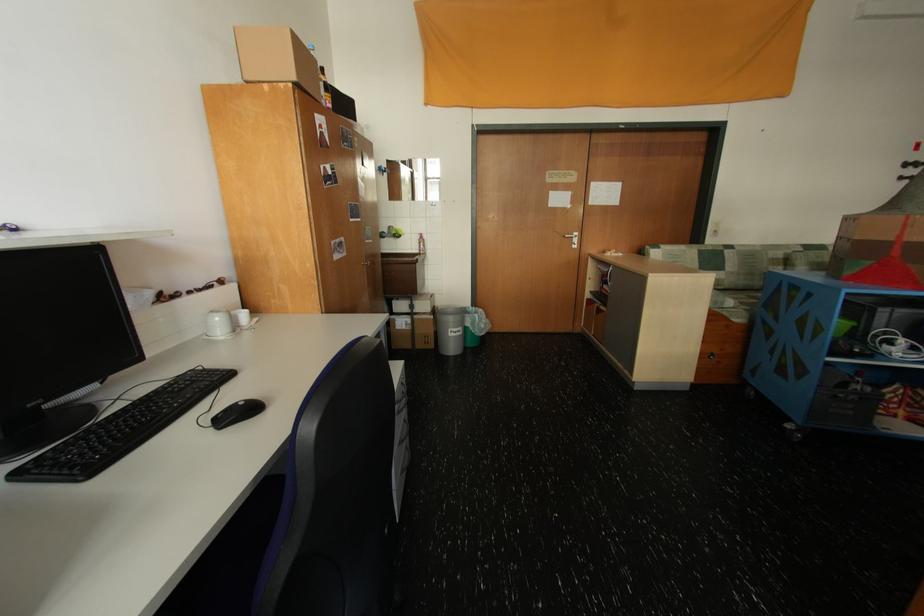
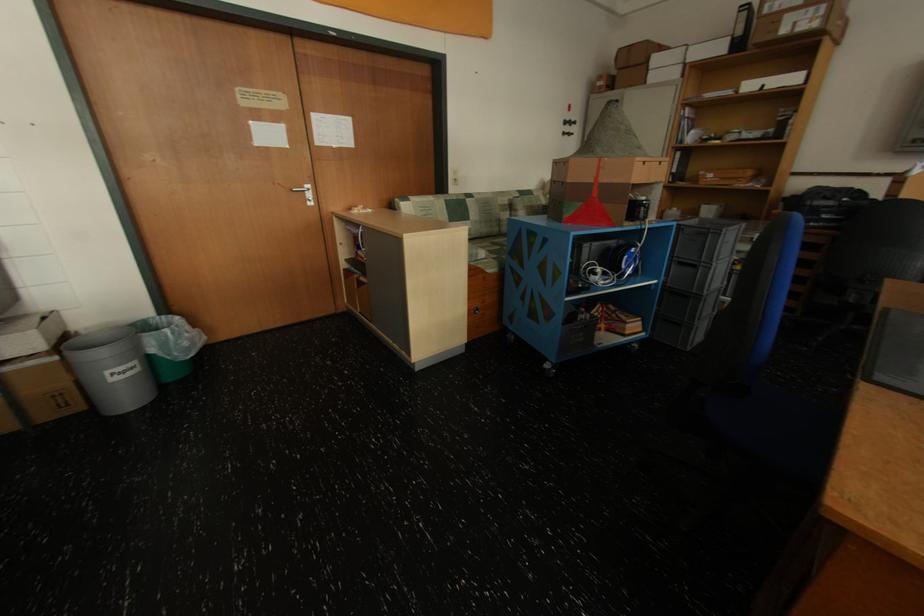
Find the pixel in the second image that matches [438,302] in the first image.

(43, 333)